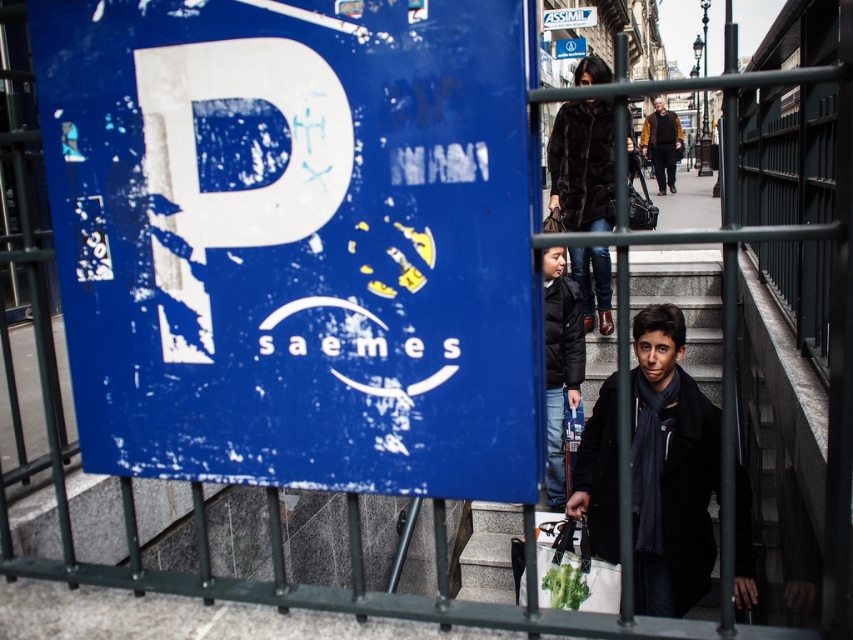
You are a delivery person carrying a package and need to pass through the area where the black matte coat at lower right and the green fabric bag at lower center are located. Can you walk between them without moving either item?

The black matte coat at lower right is positioned on the right side of green fabric bag at lower center, so there is space between them for you to walk through.

You are a delivery person who needs to place a package between the black matte jacket at center and the green fabric bag at lower center. The package is 3 feet long. Is there enough space between them to place the package?

The black matte jacket at center is 4.51 feet from the green fabric bag at lower center. Since the package is 3 feet long, there is sufficient space to place it between them.